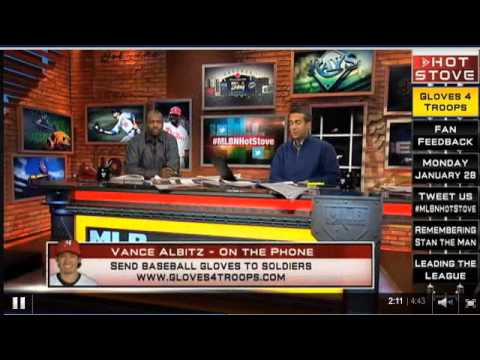
Identify the location of lots of paper on table. (288, 191), (217, 178), (184, 179), (137, 177).